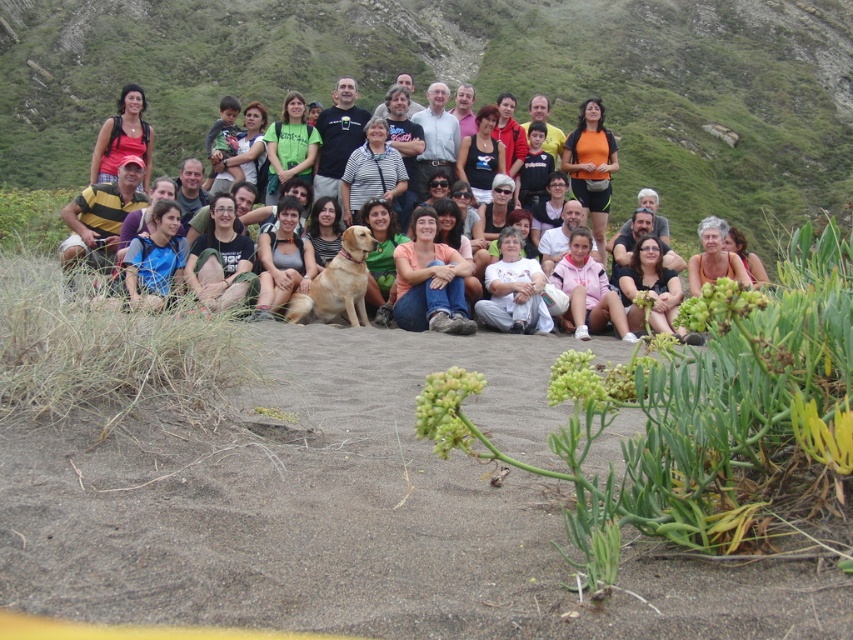
Question: Can you confirm if matte black shirt at center is wider than matte orange shirt at center?

Choices:
 (A) no
 (B) yes

Answer: (B)

Question: Is brown sandy soil at center above matte black backpack at center?

Choices:
 (A) no
 (B) yes

Answer: (A)

Question: Which is nearer to the matte orange shirt at center?

Choices:
 (A) matte black backpack at center
 (B) matte black shirt at center
 (C) brown sandy soil at center

Answer: (B)

Question: Does brown sandy soil at center have a lesser width compared to matte orange shirt at center?

Choices:
 (A) no
 (B) yes

Answer: (A)

Question: Which point is farther to the camera?

Choices:
 (A) (462, 305)
 (B) (134, 96)

Answer: (B)

Question: Which point is closer to the camera taking this photo?

Choices:
 (A) (428, 205)
 (B) (148, 148)
 (C) (9, 563)

Answer: (C)